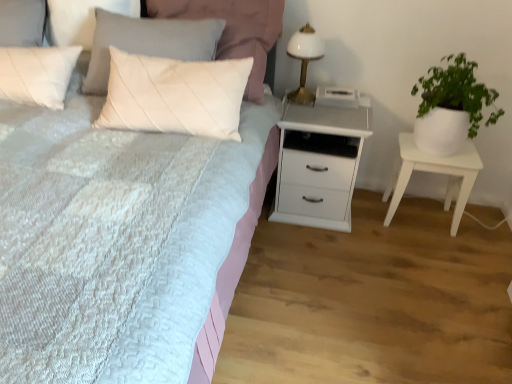
Question: Does white textured bed at center have a greater height compared to green leafy plant in white pot at right?

Choices:
 (A) no
 (B) yes

Answer: (B)

Question: Is white textured bed at center with green leafy plant in white pot at right?

Choices:
 (A) yes
 (B) no

Answer: (B)

Question: Can you confirm if white textured bed at center is positioned to the right of green leafy plant in white pot at right?

Choices:
 (A) yes
 (B) no

Answer: (B)

Question: From the image's perspective, is white textured bed at center beneath green leafy plant in white pot at right?

Choices:
 (A) no
 (B) yes

Answer: (B)

Question: Is white textured bed at center in front of green leafy plant in white pot at right?

Choices:
 (A) no
 (B) yes

Answer: (B)

Question: Looking at the image, does white wood chest of drawers at center seem bigger or smaller compared to white matte nightstand at right?

Choices:
 (A) small
 (B) big

Answer: (B)

Question: Is white wood chest of drawers at center wider or thinner than white matte nightstand at right?

Choices:
 (A) wide
 (B) thin

Answer: (A)

Question: In terms of height, does white wood chest of drawers at center look taller or shorter compared to white matte nightstand at right?

Choices:
 (A) short
 (B) tall

Answer: (B)

Question: Is white wood chest of drawers at center in front of or behind white matte nightstand at right in the image?

Choices:
 (A) front
 (B) behind

Answer: (A)

Question: Looking at the image, does white textured bed at center seem bigger or smaller compared to white wood chest of drawers at center?

Choices:
 (A) big
 (B) small

Answer: (A)

Question: From a real-world perspective, is white textured bed at center physically located above or below white wood chest of drawers at center?

Choices:
 (A) below
 (B) above

Answer: (B)

Question: Considering the positions of point (132, 349) and point (331, 223), is point (132, 349) closer or farther from the camera than point (331, 223)?

Choices:
 (A) farther
 (B) closer

Answer: (B)

Question: Looking at their shapes, would you say white textured bed at center is wider or thinner than white wood chest of drawers at center?

Choices:
 (A) wide
 (B) thin

Answer: (A)

Question: From their relative heights in the image, would you say white wood chest of drawers at center is taller or shorter than white textured bed at center?

Choices:
 (A) short
 (B) tall

Answer: (A)

Question: Relative to white textured bed at center, is white wood chest of drawers at center in front or behind?

Choices:
 (A) front
 (B) behind

Answer: (B)